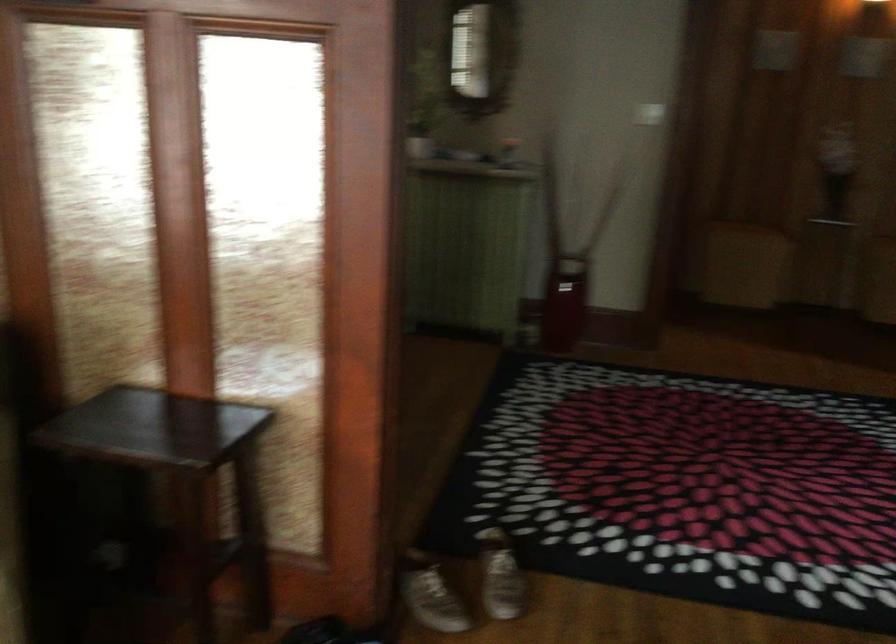
Based on the continuous images, in which direction is the camera rotating?

The camera's rotation is toward right-down.